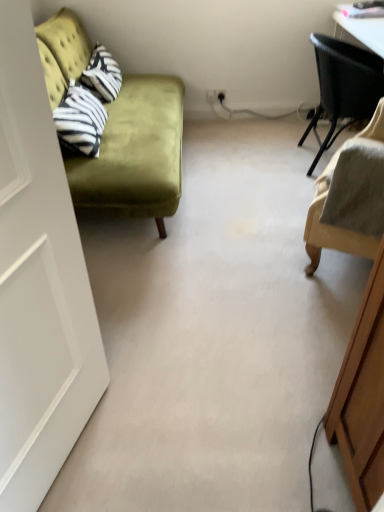
Question: Are beige fabric chair at right, marked as the 1th chair in a front-to-back arrangement, and white matte door at left far apart?

Choices:
 (A) yes
 (B) no

Answer: (A)

Question: Is beige fabric chair at right, marked as the 1th chair in a front-to-back arrangement, thinner than white matte door at left?

Choices:
 (A) no
 (B) yes

Answer: (A)

Question: Considering the relative sizes of beige fabric chair at right, the second chair from the back, and white matte door at left in the image provided, is beige fabric chair at right, the second chair from the back, shorter than white matte door at left?

Choices:
 (A) yes
 (B) no

Answer: (A)

Question: Is beige fabric chair at right, marked as the 1th chair in a front-to-back arrangement, oriented away from white matte door at left?

Choices:
 (A) yes
 (B) no

Answer: (B)

Question: Can we say beige fabric chair at right, which ranks as the second chair in top-to-bottom order, lies outside white matte door at left?

Choices:
 (A) no
 (B) yes

Answer: (B)

Question: From a real-world perspective, is velvet green couch at left positioned above or below black woven chair at upper right, acting as the 2th chair starting from the front?

Choices:
 (A) above
 (B) below

Answer: (A)

Question: Considering the positions of velvet green couch at left and black woven chair at upper right, positioned as the 1th chair in back-to-front order, in the image, is velvet green couch at left taller or shorter than black woven chair at upper right, positioned as the 1th chair in back-to-front order,?

Choices:
 (A) short
 (B) tall

Answer: (B)

Question: In the image, is velvet green couch at left on the left side or the right side of black woven chair at upper right, acting as the 2th chair starting from the front?

Choices:
 (A) left
 (B) right

Answer: (A)

Question: Relative to black woven chair at upper right, positioned as the 1th chair in back-to-front order, is velvet green couch at left in front or behind?

Choices:
 (A) behind
 (B) front

Answer: (B)

Question: From a real-world perspective, is black woven chair at upper right, arranged as the second chair when ordered from the bottom, above or below beige fabric chair at right, the first chair in the bottom-to-top sequence?

Choices:
 (A) above
 (B) below

Answer: (B)

Question: Is black woven chair at upper right, acting as the 2th chair starting from the front, to the left or to the right of beige fabric chair at right, the second chair from the back, in the image?

Choices:
 (A) left
 (B) right

Answer: (B)

Question: Is black woven chair at upper right, arranged as the second chair when ordered from the bottom, wider or thinner than beige fabric chair at right, the second chair from the back?

Choices:
 (A) thin
 (B) wide

Answer: (B)

Question: Looking at the image, does black woven chair at upper right, positioned as the 1th chair in back-to-front order, seem bigger or smaller compared to beige fabric chair at right, which ranks as the second chair in top-to-bottom order?

Choices:
 (A) small
 (B) big

Answer: (B)

Question: Looking at their shapes, would you say white matte door at left is wider or thinner than velvet green couch at left?

Choices:
 (A) wide
 (B) thin

Answer: (B)

Question: Is point (13, 420) closer or farther from the camera than point (125, 96)?

Choices:
 (A) farther
 (B) closer

Answer: (B)